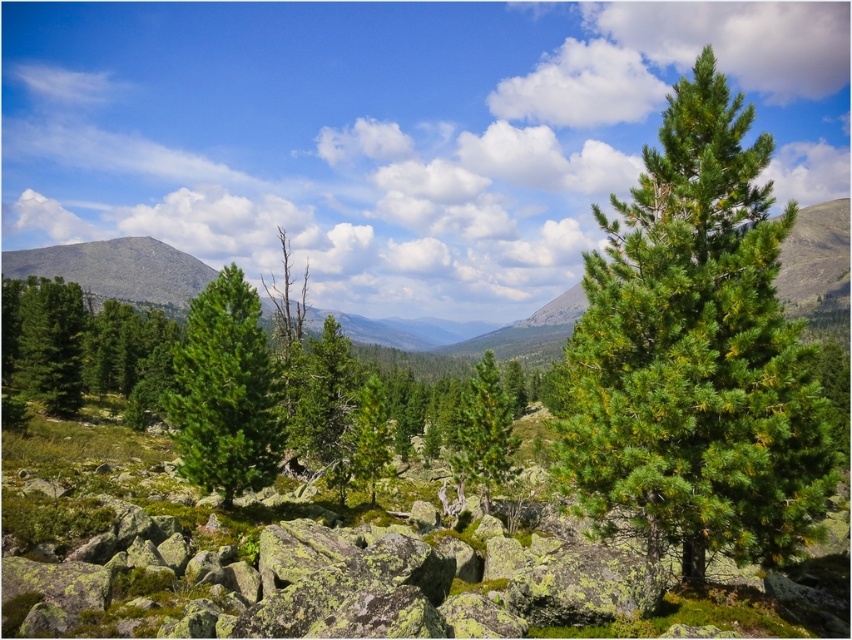
Which of these two, green needle-like tree at center-right or green matte tree at center, stands shorter?

green matte tree at center is shorter.

I want to click on green needle-like tree at center-right, so click(x=695, y=353).

Where is `green needle-like tree at center-right`? green needle-like tree at center-right is located at coordinates (695, 353).

Is point (711, 100) more distant than point (7, 282)?

That is False.

Can you confirm if green needle-like tree at center-right is thinner than green matte tree at left?

Yes.

Is point (609, 497) positioned behind point (81, 355)?

No, it is not.

Where is `green needle-like tree at center-right`? green needle-like tree at center-right is located at coordinates (695, 353).

Consider the image. Can you confirm if green matte tree at center is wider than green matte tree at left?

No.

Is green matte tree at center smaller than green matte tree at left?

Result: Yes.

Which is in front, point (199, 376) or point (117, 388)?

Point (199, 376)

Where is `green matte tree at center`? Image resolution: width=852 pixels, height=640 pixels. green matte tree at center is located at coordinates (226, 392).